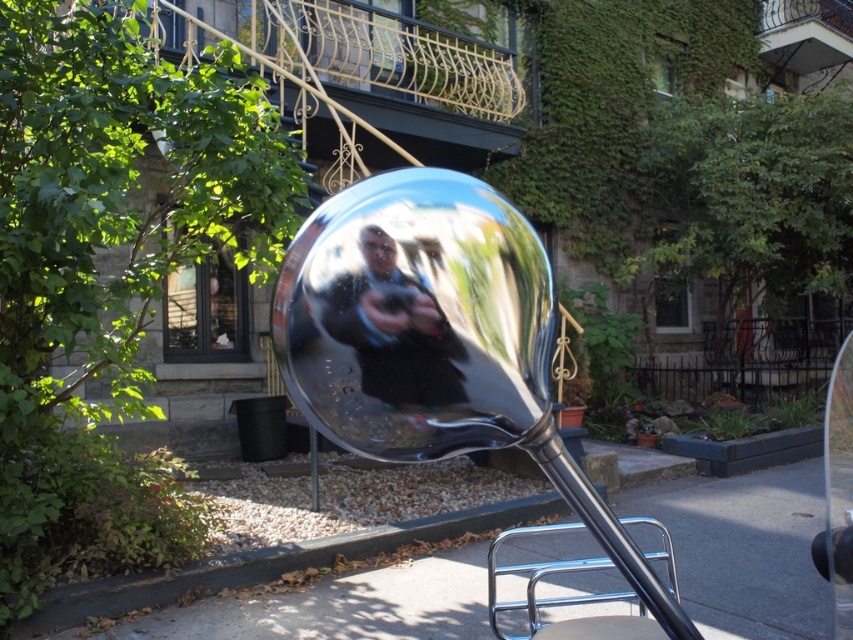
You are standing at the center of the image and want to walk to the smooth concrete pavement at lower center. Which direction should you move to reach it?

The smooth concrete pavement at lower center is located at point (746,550), so you should move downward and to the right to reach it.

You are standing in front of the sculpture and want to touch both the chrome metallic rearview mirror at center and the shiny metallic sphere at center. Which object should you reach for first to touch the one closer to you?

You should reach for the chrome metallic rearview mirror at center first because it is closer to the viewer than the shiny metallic sphere at center.

You are standing in the urban setting described. You need to locate the chrome metallic rearview mirror at center. What are the coordinates of its position?

The coordinates of the chrome metallic rearview mirror at center are at point (x=440, y=348).